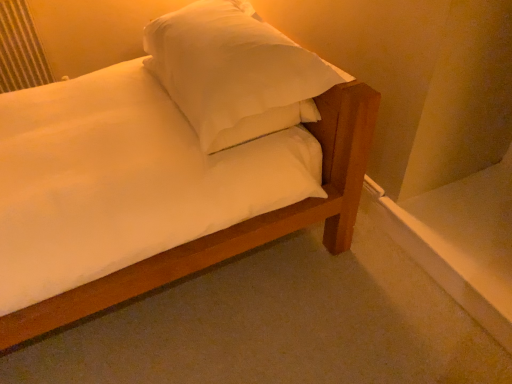
Question: In the image, is white soft pillow at upper center on the left side or the right side of metallic silver radiator at upper left?

Choices:
 (A) right
 (B) left

Answer: (A)

Question: Does point (202, 148) appear closer or farther from the camera than point (22, 11)?

Choices:
 (A) closer
 (B) farther

Answer: (A)

Question: Which is farther from the metallic silver radiator at upper left?

Choices:
 (A) white matte bed at center
 (B) white soft pillow at upper center

Answer: (A)

Question: Which of these objects is positioned closest to the white soft pillow at upper center?

Choices:
 (A) metallic silver radiator at upper left
 (B) white matte bed at center

Answer: (B)